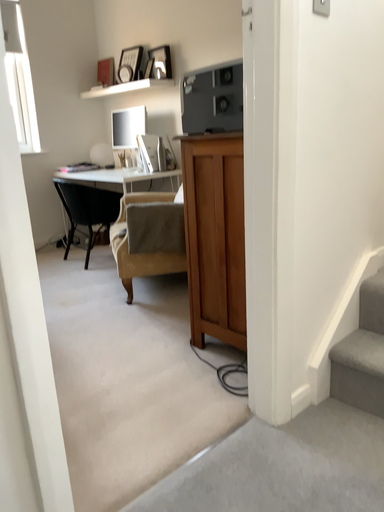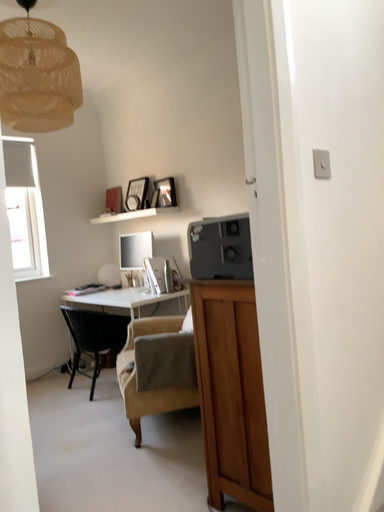
Question: How did the camera likely rotate when shooting the video?

Choices:
 (A) rotated downward
 (B) rotated upward

Answer: (B)